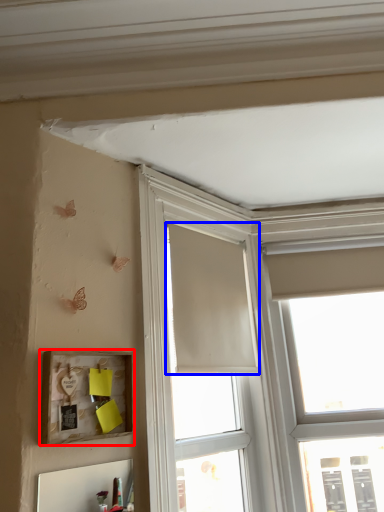
Question: Which object is closer to the camera taking this photo, picture frame (highlighted by a red box) or curtain (highlighted by a blue box)?

Choices:
 (A) picture frame
 (B) curtain

Answer: (A)